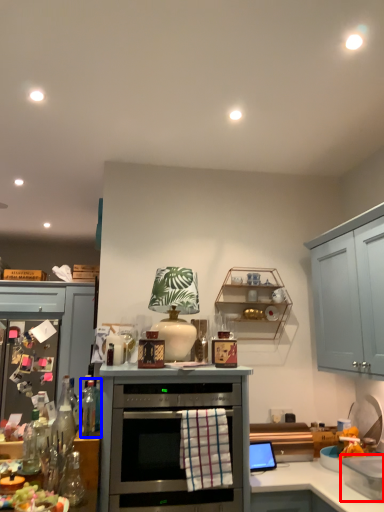
Question: Which object is further to the camera taking this photo, appliance (highlighted by a red box) or bottle (highlighted by a blue box)?

Choices:
 (A) appliance
 (B) bottle

Answer: (B)